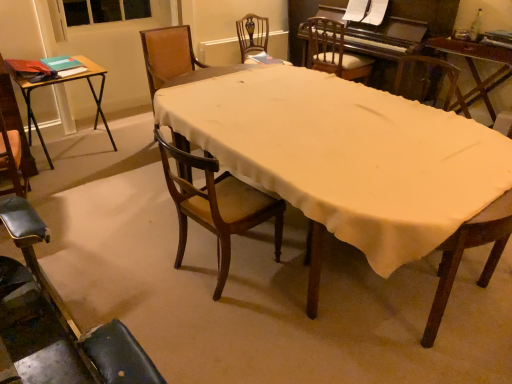
Question: Considering the relative positions of wooden table at center and leather seat at lower left, which is counted as the first chair, starting from the front, in the image provided, is wooden table at center behind leather seat at lower left, which is counted as the first chair, starting from the front,?

Choices:
 (A) yes
 (B) no

Answer: (A)

Question: From a real-world perspective, is wooden table at center beneath leather seat at lower left, which is counted as the first chair, starting from the front?

Choices:
 (A) yes
 (B) no

Answer: (B)

Question: Is wooden table at center outside leather seat at lower left, which is counted as the first chair, starting from the front?

Choices:
 (A) no
 (B) yes

Answer: (B)

Question: Does wooden table at center appear on the right side of leather seat at lower left, which is counted as the first chair, starting from the front?

Choices:
 (A) yes
 (B) no

Answer: (A)

Question: From the image's perspective, is wooden table at center under leather seat at lower left, the fifth chair positioned from the back?

Choices:
 (A) yes
 (B) no

Answer: (B)

Question: From the image's perspective, is wooden table at center located above leather seat at lower left, the fifth chair positioned from the back?

Choices:
 (A) no
 (B) yes

Answer: (B)

Question: From the image's perspective, is wooden chair at center, which is the third chair from front to back, located above wooden chair at upper center, which is counted as the fourth chair, starting from the front?

Choices:
 (A) no
 (B) yes

Answer: (A)

Question: From a real-world perspective, is wooden chair at center, which is the third chair from front to back, physically below wooden chair at upper center, positioned as the 2th chair in back-to-front order?

Choices:
 (A) yes
 (B) no

Answer: (A)

Question: Considering the relative positions of wooden chair at center, placed as the 3th chair when sorted from back to front, and wooden chair at upper center, positioned as the 2th chair in back-to-front order, in the image provided, is wooden chair at center, placed as the 3th chair when sorted from back to front, to the right of wooden chair at upper center, positioned as the 2th chair in back-to-front order, from the viewer's perspective?

Choices:
 (A) no
 (B) yes

Answer: (A)

Question: Is wooden chair at center, placed as the 3th chair when sorted from back to front, directly adjacent to wooden chair at upper center, which is counted as the fourth chair, starting from the front?

Choices:
 (A) yes
 (B) no

Answer: (B)

Question: Can you confirm if wooden chair at center, placed as the 3th chair when sorted from back to front, is taller than wooden chair at upper center, which is counted as the fourth chair, starting from the front?

Choices:
 (A) no
 (B) yes

Answer: (B)

Question: Considering the relative sizes of wooden chair at center, which is the third chair from front to back, and wooden chair at upper center, which is counted as the fourth chair, starting from the front, in the image provided, is wooden chair at center, which is the third chair from front to back, wider than wooden chair at upper center, which is counted as the fourth chair, starting from the front,?

Choices:
 (A) no
 (B) yes

Answer: (B)

Question: Does wooden chair with ornate backrest at center, the first chair viewed from the back, have a lesser width compared to wooden table at center, which appears as the 2th table when viewed from the left?

Choices:
 (A) no
 (B) yes

Answer: (B)